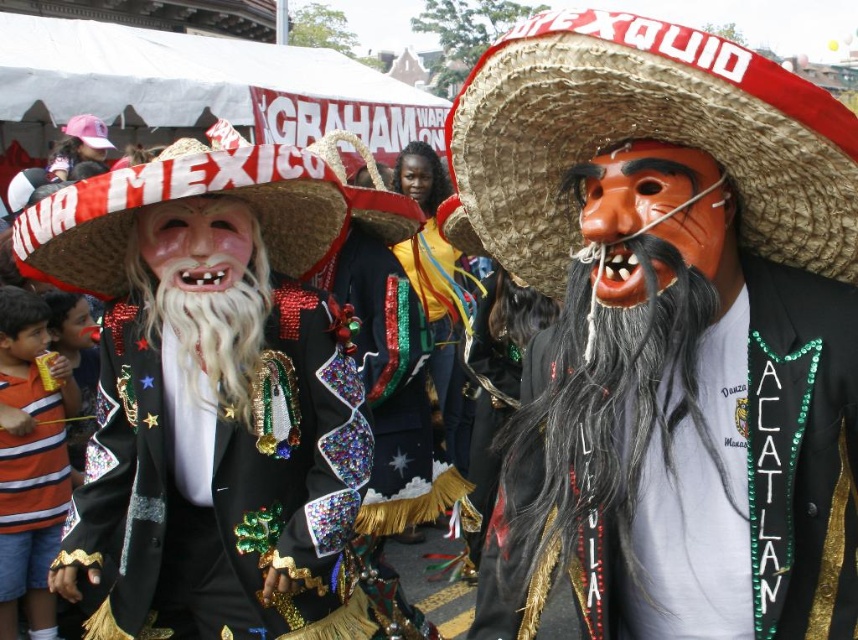
You are a photographer at the parade and want to capture both the matte black mask at center and the shiny sequined jacket at center in a single photo. Which object should you focus on first to ensure both are in frame?

The matte black mask at center is positioned on the right side of the shiny sequined jacket at center, so you should focus on the shiny sequined jacket at center first to ensure both are in frame.